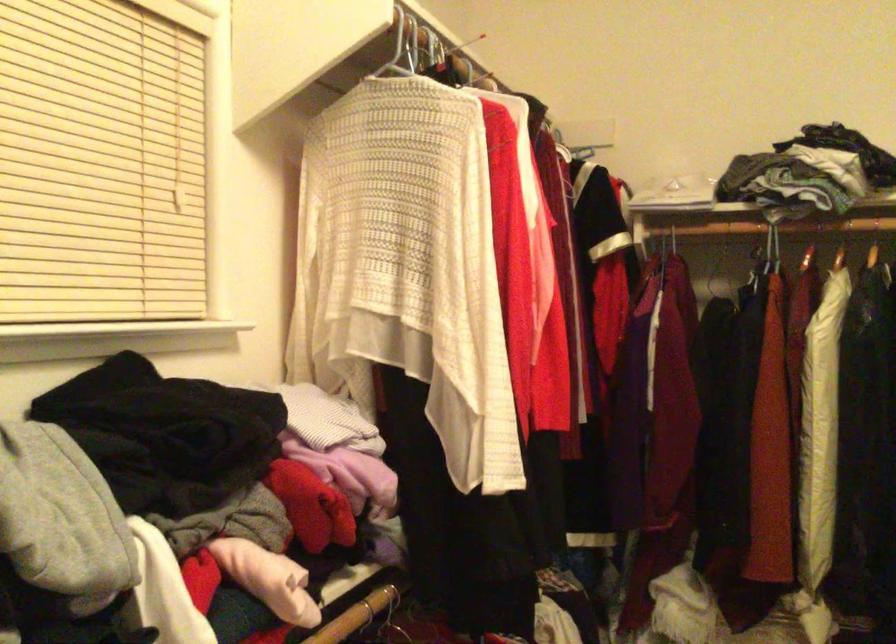
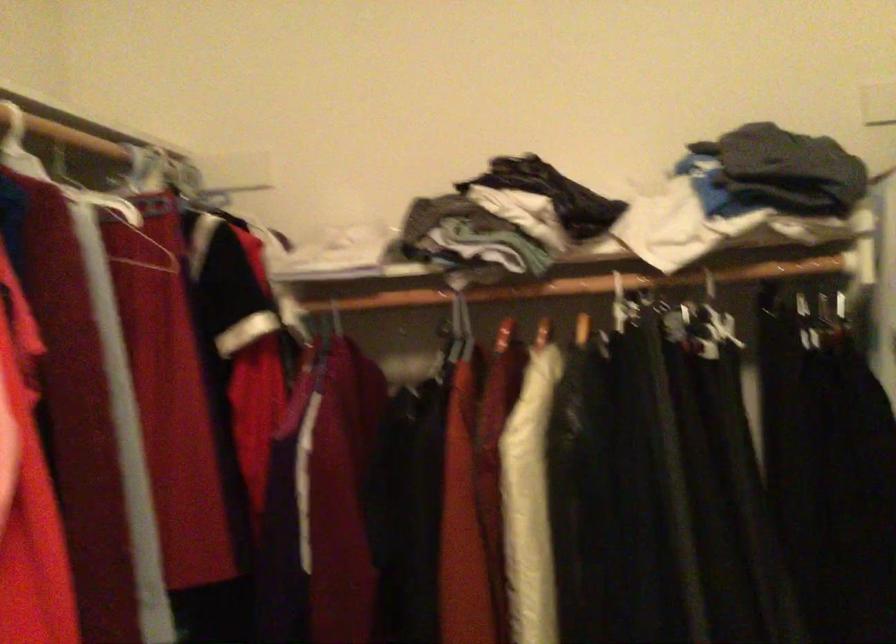
Question: How did the camera likely rotate?

Choices:
 (A) Left
 (B) Right
 (C) Up
 (D) Down

Answer: (B)